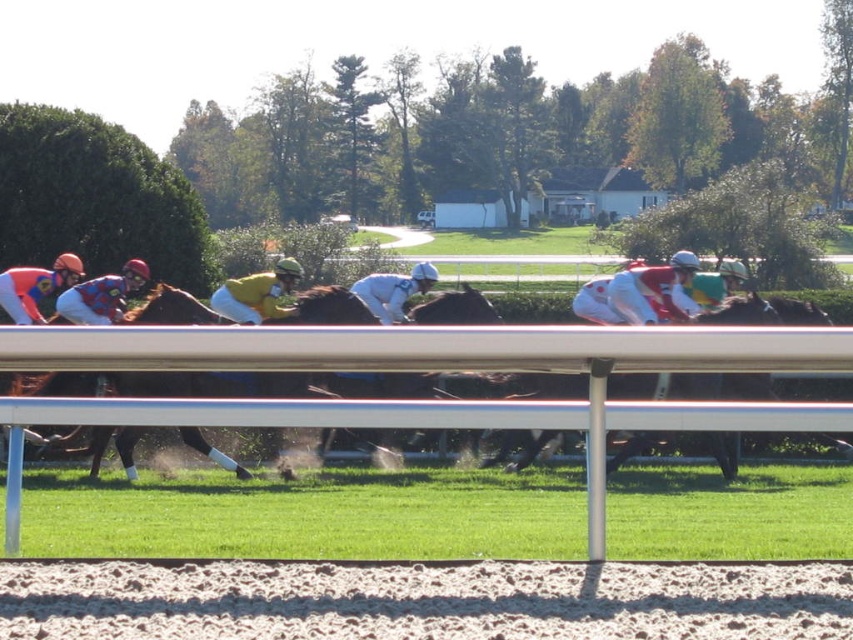
Question: Can you confirm if brown glossy horse at center is positioned to the left of shiny red jersey at center?

Choices:
 (A) yes
 (B) no

Answer: (A)

Question: Among these objects, which one is nearest to the camera?

Choices:
 (A) matte orange helmet at left
 (B) green matte helmet at center

Answer: (A)

Question: Considering the relative positions of shiny red jersey at center and green matte helmet at center in the image provided, where is shiny red jersey at center located with respect to green matte helmet at center?

Choices:
 (A) below
 (B) above

Answer: (A)

Question: Which object is positioned closest to the brown glossy horse at center?

Choices:
 (A) yellow matte jockey at center
 (B) white matte jockey at center
 (C) brushed metal helmet at left
 (D) brown textured dirt track at lower center

Answer: (D)

Question: Does yellow matte jockey at center appear over brushed metal helmet at left?

Choices:
 (A) no
 (B) yes

Answer: (B)

Question: Among these objects, which one is farthest from the camera?

Choices:
 (A) brown glossy horse at center
 (B) shiny red jersey at center

Answer: (B)